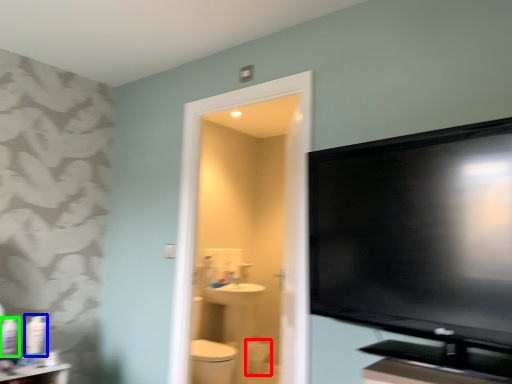
Question: Which object is the farthest from toilet bowl (highlighted by a red box)? Choose among these: toiletry (highlighted by a blue box) or toiletry (highlighted by a green box).

Choices:
 (A) toiletry
 (B) toiletry

Answer: (B)